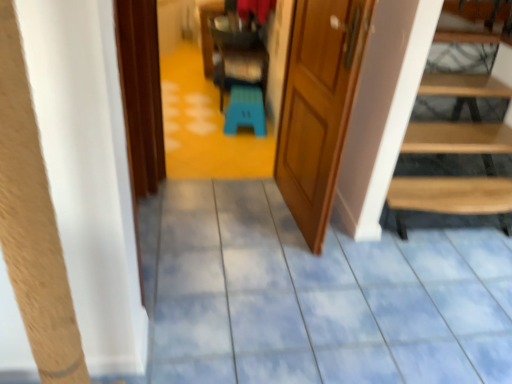
Question: Is point (254, 94) closer or farther from the camera than point (161, 291)?

Choices:
 (A) farther
 (B) closer

Answer: (A)

Question: Looking at their shapes, would you say blue plastic stool at center is wider or thinner than blue glossy tile floor at center?

Choices:
 (A) wide
 (B) thin

Answer: (B)

Question: Which object is the farthest from the blue plastic stool at center?

Choices:
 (A) blue glossy tile floor at center
 (B) wooden door at center

Answer: (A)

Question: Based on their relative distances, which object is farther from the blue glossy tile floor at center?

Choices:
 (A) wooden door at center
 (B) blue plastic stool at center

Answer: (B)